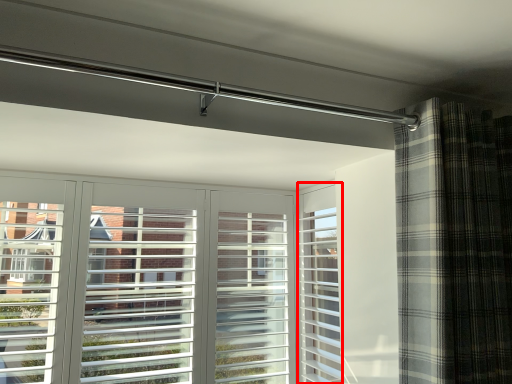
Question: From the image's perspective, where is screen door (annotated by the red box) located relative to curtain?

Choices:
 (A) below
 (B) above

Answer: (A)